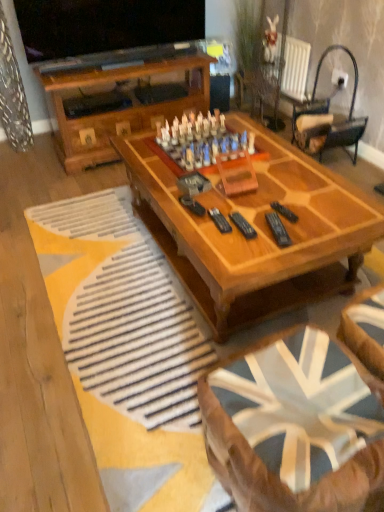
This screenshot has width=384, height=512. Find the location of `vacant location behind black plastic remote at center, positioned as the first remote in right-to-left order`. vacant location behind black plastic remote at center, positioned as the first remote in right-to-left order is located at coordinates coord(274,191).